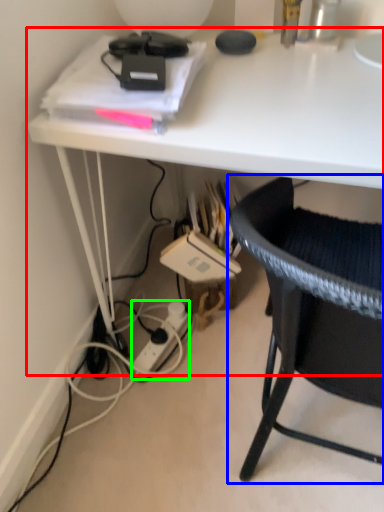
Question: Which object is positioned closest to desk (highlighted by a red box)? Select from chair (highlighted by a blue box) and power outlet (highlighted by a green box).

Choices:
 (A) chair
 (B) power outlet

Answer: (A)